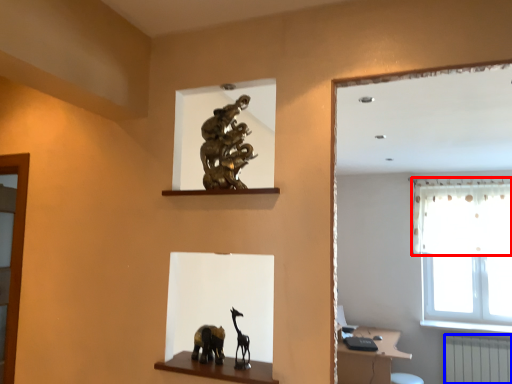
Question: Which of the following is the farthest to the observer, curtain (highlighted by a red box) or radiator (highlighted by a blue box)?

Choices:
 (A) curtain
 (B) radiator

Answer: (A)